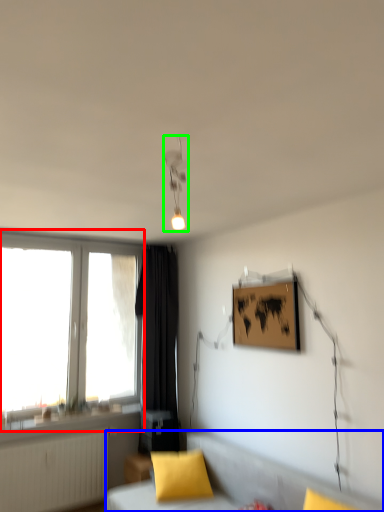
Question: Based on their relative distances, which object is farther from window (highlighted by a red box)? Choose from furniture (highlighted by a blue box) and light fixture (highlighted by a green box).

Choices:
 (A) furniture
 (B) light fixture

Answer: (B)